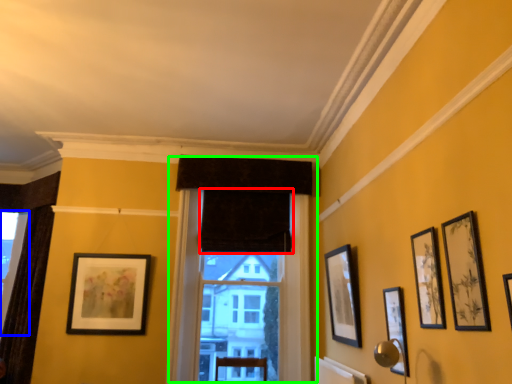
Question: Which is farther away from curtain (highlighted by a red box)? window (highlighted by a blue box) or window (highlighted by a green box)?

Choices:
 (A) window
 (B) window

Answer: (A)